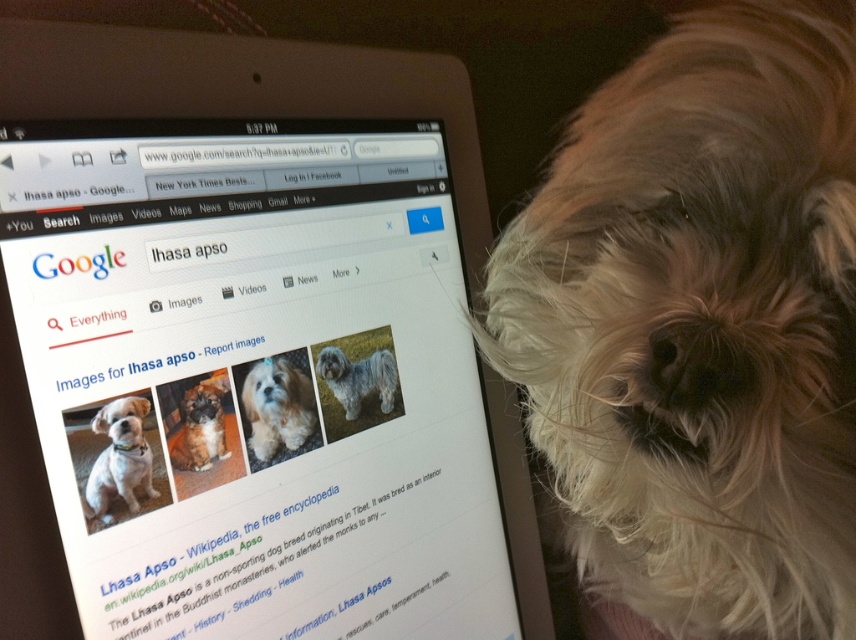
Question: Considering the relative positions of satin silver tablet at upper left and fuzzy white dog at center in the image provided, where is satin silver tablet at upper left located with respect to fuzzy white dog at center?

Choices:
 (A) above
 (B) below

Answer: (B)

Question: From the image, what is the correct spatial relationship of satin silver tablet at upper left in relation to fluffy white dog at center?

Choices:
 (A) above
 (B) below

Answer: (A)

Question: Considering the relative positions of fluffy white dog at center and fuzzy white dog at center in the image provided, where is fluffy white dog at center located with respect to fuzzy white dog at center?

Choices:
 (A) below
 (B) above

Answer: (A)

Question: Which of the following is the farthest from the observer?

Choices:
 (A) satin silver tablet at upper left
 (B) fluffy white dog at center

Answer: (B)

Question: Which object appears farthest from the camera in this image?

Choices:
 (A) brown fur dog at center
 (B) fuzzy white dog at center
 (C) fluffy white dog at center
 (D) fluffy white fur at center

Answer: (B)

Question: Which point is farther from the camera taking this photo?

Choices:
 (A) (516, 465)
 (B) (122, 429)

Answer: (A)